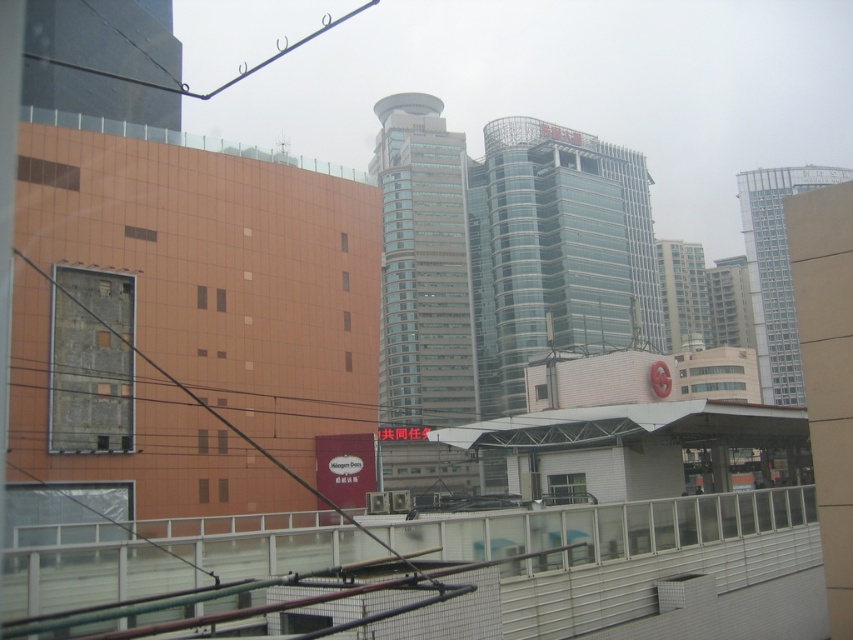
Question: Which point is farther from the camera taking this photo?

Choices:
 (A) (538, 332)
 (B) (785, 266)
 (C) (421, 250)

Answer: (B)

Question: Which object is positioned closest to the light gray glass tower at right?

Choices:
 (A) glassy modern building at center
 (B) transparent glass tower at center

Answer: (B)

Question: Does glassy modern building at center come in front of light gray glass tower at right?

Choices:
 (A) no
 (B) yes

Answer: (B)

Question: Observing the image, what is the correct spatial positioning of transparent glass tower at center in reference to glassy modern building at center?

Choices:
 (A) below
 (B) above

Answer: (A)

Question: Which object is farther from the camera taking this photo?

Choices:
 (A) glassy modern building at center
 (B) light gray glass tower at right
 (C) transparent glass tower at center

Answer: (B)

Question: From the image, what is the correct spatial relationship of glassy modern building at center in relation to light gray glass tower at right?

Choices:
 (A) right
 (B) left

Answer: (B)